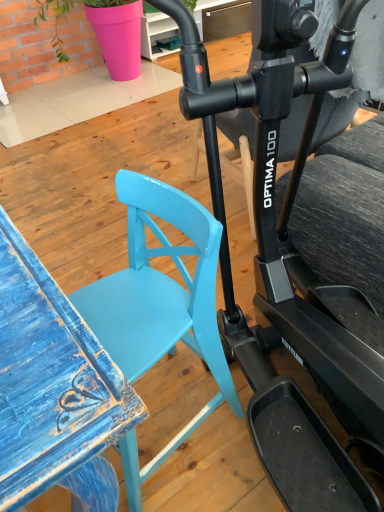
Question: Is matte blue chair at center with glossy black stationary bicycle at center?

Choices:
 (A) no
 (B) yes

Answer: (A)

Question: Is there a large distance between matte blue chair at center and glossy black stationary bicycle at center?

Choices:
 (A) yes
 (B) no

Answer: (B)

Question: Considering the relative positions of matte blue chair at center and glossy black stationary bicycle at center in the image provided, is matte blue chair at center to the left of glossy black stationary bicycle at center from the viewer's perspective?

Choices:
 (A) yes
 (B) no

Answer: (A)

Question: From the image's perspective, does matte blue chair at center appear higher than glossy black stationary bicycle at center?

Choices:
 (A) no
 (B) yes

Answer: (A)

Question: Considering the relative positions of matte blue chair at center and glossy black stationary bicycle at center in the image provided, is matte blue chair at center to the right of glossy black stationary bicycle at center from the viewer's perspective?

Choices:
 (A) no
 (B) yes

Answer: (A)

Question: Can you confirm if matte blue chair at center is smaller than glossy black stationary bicycle at center?

Choices:
 (A) no
 (B) yes

Answer: (B)

Question: From a real-world perspective, is glossy black stationary bicycle at center physically below matte blue chair at center?

Choices:
 (A) no
 (B) yes

Answer: (A)

Question: Considering the relative sizes of glossy black stationary bicycle at center and matte blue chair at center in the image provided, is glossy black stationary bicycle at center shorter than matte blue chair at center?

Choices:
 (A) no
 (B) yes

Answer: (A)

Question: From the image's perspective, is glossy black stationary bicycle at center located beneath matte blue chair at center?

Choices:
 (A) yes
 (B) no

Answer: (B)

Question: Is glossy black stationary bicycle at center turned away from matte blue chair at center?

Choices:
 (A) yes
 (B) no

Answer: (B)

Question: Can you confirm if glossy black stationary bicycle at center is taller than matte blue chair at center?

Choices:
 (A) yes
 (B) no

Answer: (A)

Question: Does glossy black stationary bicycle at center have a smaller size compared to matte blue chair at center?

Choices:
 (A) no
 (B) yes

Answer: (A)

Question: Relative to matte blue chair at center, is glossy black stationary bicycle at center in front or behind?

Choices:
 (A) behind
 (B) front

Answer: (B)